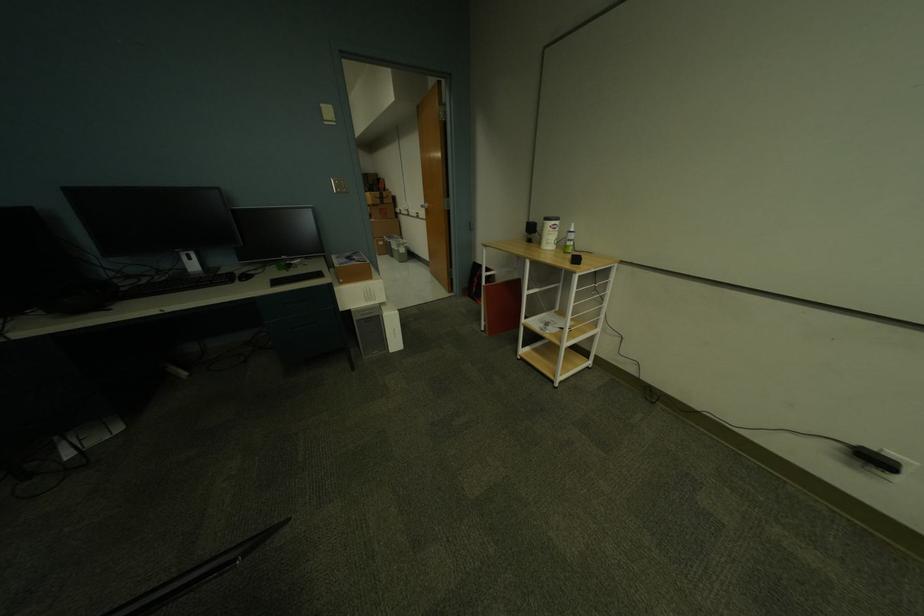
Where would you lift the cardboard box? Please return your answer as a coordinate pair (x, y).

(380, 207)